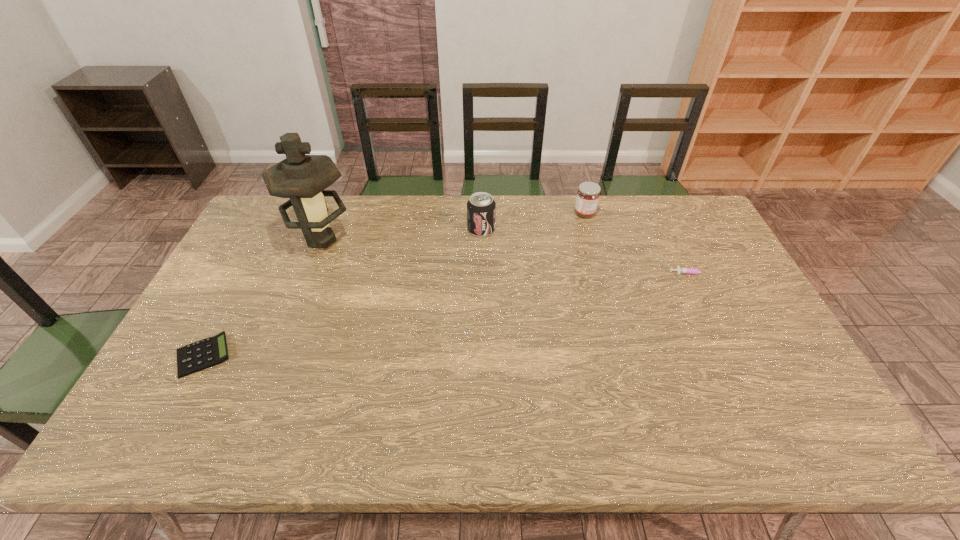
Locate an element on the screen. Image resolution: width=960 pixels, height=540 pixels. the tallest object is located at coordinates (303, 178).

Locate an element on the screen. soda can is located at coordinates (481, 208).

Where is `the farthest object`? The height and width of the screenshot is (540, 960). the farthest object is located at coordinates click(588, 194).

You are a GUI agent. You are given a task and a screenshot of the screen. Output one action in this format:
    pyautogui.click(x=<x>, y=<y>)
    Task: Click on the jam
    
    Given the screenshot: What is the action you would take?
    pyautogui.click(x=588, y=194)

Find the location of `syringe`. syringe is located at coordinates (682, 270).

Image resolution: width=960 pixels, height=540 pixels. Identify the location of the rightmost object. (682, 270).

At what (x,y) coordinates should I click in order to perform the action: click on the nearest object. Please return your answer as a coordinate pair (x, y). Image resolution: width=960 pixels, height=540 pixels. Looking at the image, I should click on (209, 352).

Locate an element on the screen. This screenshot has height=540, width=960. the shortest object is located at coordinates (209, 352).

Identify the location of free spot located on the right of the oil lamp. This screenshot has height=540, width=960. (439, 240).

Identify the location of vacant space situated on the front of the third object from left to right. This screenshot has width=960, height=540. (481, 250).